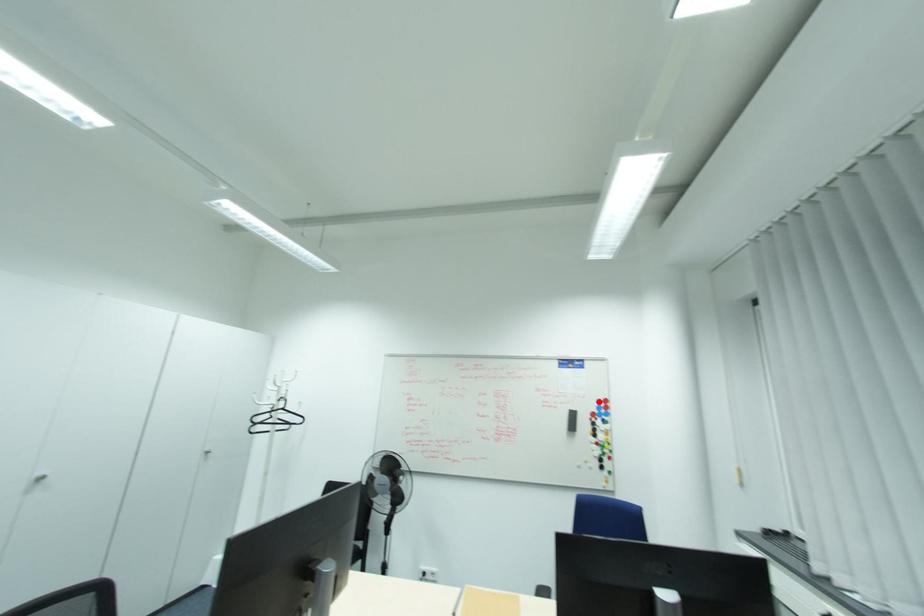
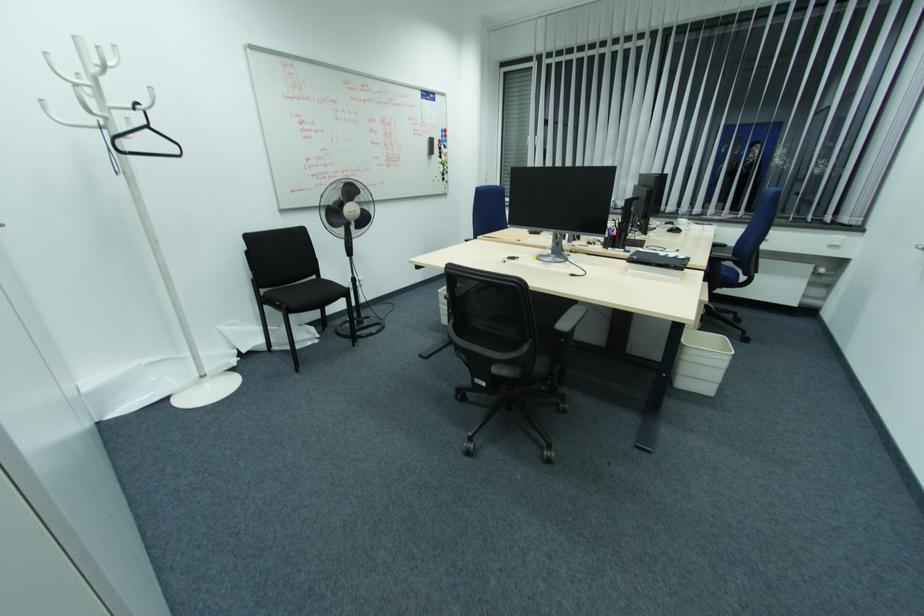
The point at the highlighted location is marked in the first image. Where is the corresponding point in the second image?

(444, 131)